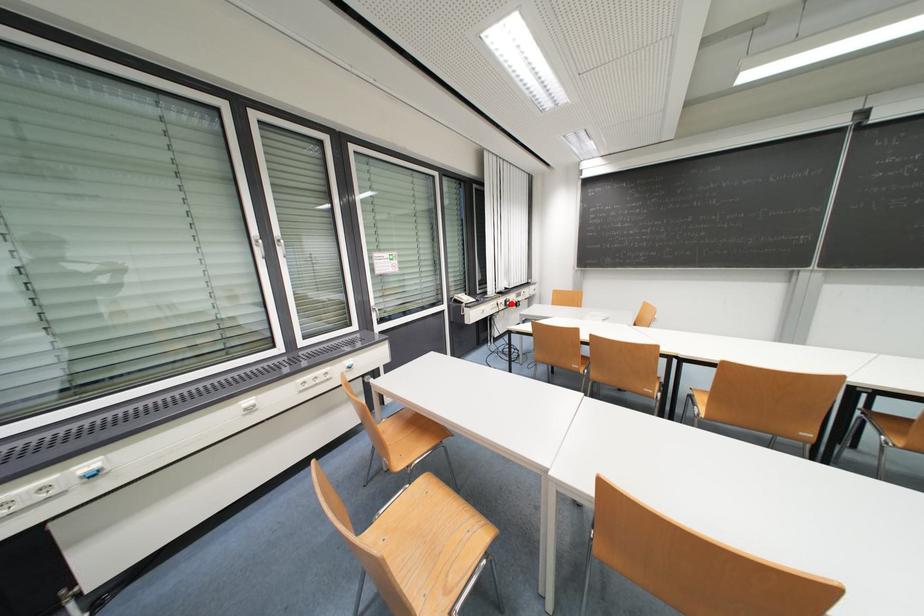
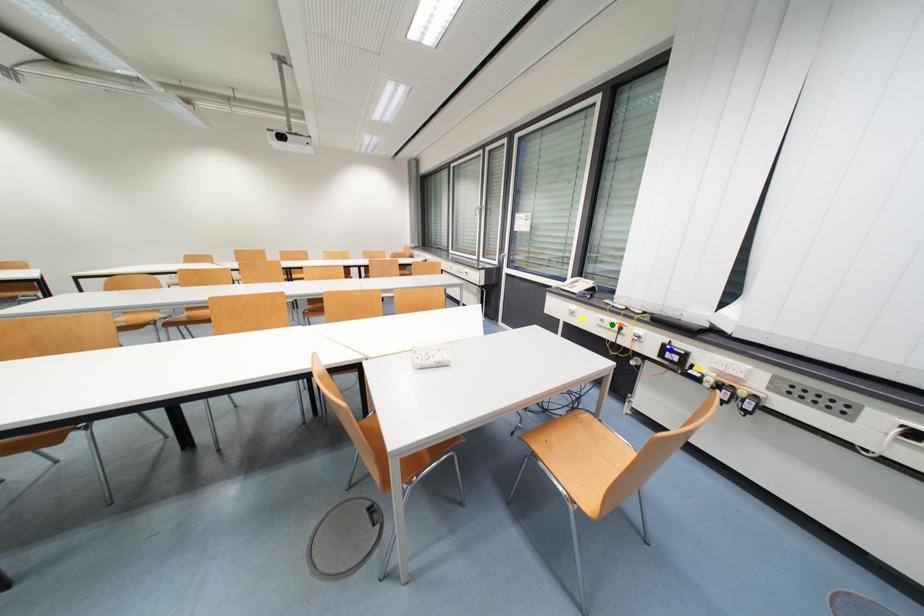
Question: I am providing you with two images of the same scene from different viewpoints. A red point is marked on the first image. You are given multiple points on the second image. Which point in image 2 is actually the same real-world point as the red point in image 1?

Choices:
 (A) green point
 (B) blue point
 (C) yellow point

Answer: (B)